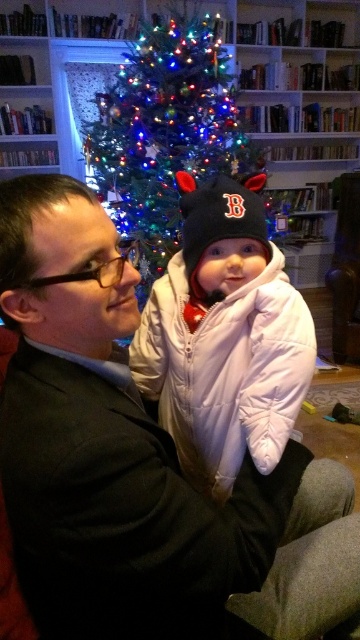
You are a guest at a holiday party and need to find a place to sit. There is a matte black suit at center and a green matte christmas tree at center. Which object takes up more space in the room?

The green matte christmas tree at center takes up more space than the matte black suit at center because the description states that the matte black suit at center occupies less space than the green matte christmas tree at center.